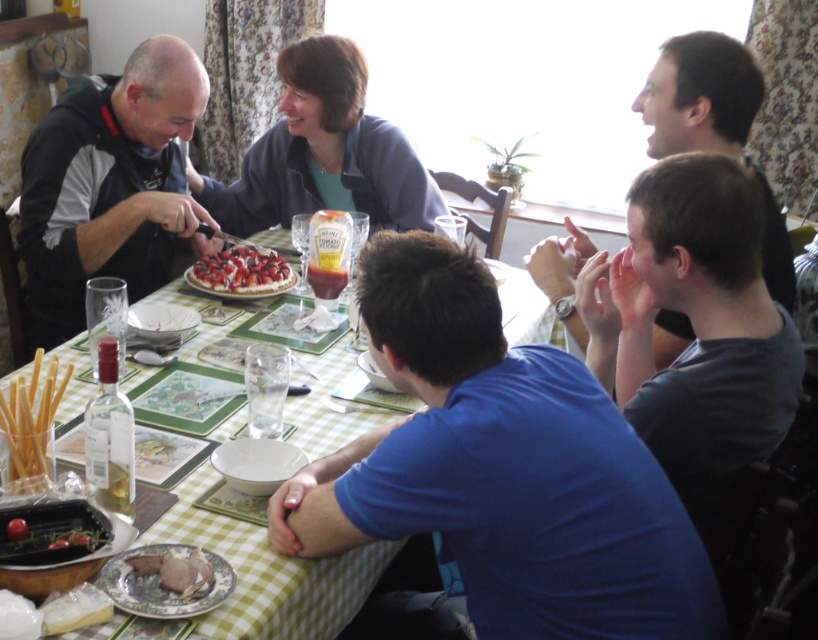
You are a photographer at the event and want to take a photo of the matte brown meat at lower left and the gray cotton shirt at right. To ensure both are in frame, should you position the camera to the left or right of the dining table?

The gray cotton shirt at right is to the right of the matte brown meat at lower left, so positioning the camera to the right of the dining table would allow both objects to be captured in the frame.